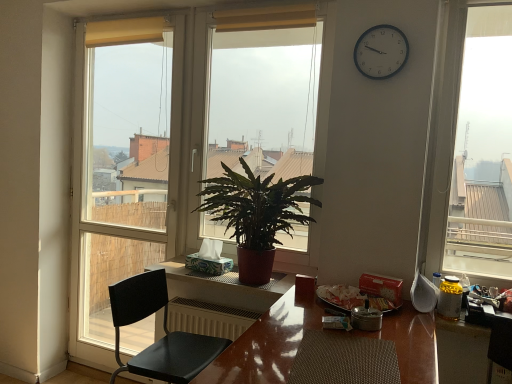
Question: Considering the relative sizes of glossy wooden table at center, acting as the 2th table starting from the back, and matte glass window at center, the second window in the left-to-right sequence, in the image provided, is glossy wooden table at center, acting as the 2th table starting from the back, thinner than matte glass window at center, the second window in the left-to-right sequence,?

Choices:
 (A) no
 (B) yes

Answer: (A)

Question: Considering the relative sizes of glossy wooden table at center, which is the 2th table in top-to-bottom order, and matte glass window at center, which appears as the first window when viewed from the right, in the image provided, is glossy wooden table at center, which is the 2th table in top-to-bottom order, smaller than matte glass window at center, which appears as the first window when viewed from the right,?

Choices:
 (A) yes
 (B) no

Answer: (B)

Question: Does glossy wooden table at center, acting as the 2th table starting from the back, have a larger size compared to matte glass window at center, the second window in the left-to-right sequence?

Choices:
 (A) yes
 (B) no

Answer: (A)

Question: Is matte glass window at center, which appears as the first window when viewed from the right, inside glossy wooden table at center, acting as the first table starting from the front?

Choices:
 (A) no
 (B) yes

Answer: (A)

Question: Is glossy wooden table at center, which is the 2th table in top-to-bottom order, further to the viewer compared to matte glass window at center, which appears as the first window when viewed from the right?

Choices:
 (A) no
 (B) yes

Answer: (A)

Question: Is glossy wooden table at center, which is the 2th table in top-to-bottom order, facing towards matte glass window at center, which appears as the first window when viewed from the right?

Choices:
 (A) no
 (B) yes

Answer: (A)

Question: Can you confirm if matte glass window at center, which appears as the first window when viewed from the right, is thinner than yellow fabric curtain at upper center, which appears as the first curtain when viewed from the right?

Choices:
 (A) no
 (B) yes

Answer: (A)

Question: Can we say matte glass window at center, which appears as the first window when viewed from the right, lies outside yellow fabric curtain at upper center, which appears as the first curtain when viewed from the right?

Choices:
 (A) yes
 (B) no

Answer: (A)

Question: Does matte glass window at center, the second window in the left-to-right sequence, turn towards yellow fabric curtain at upper center, placed as the second curtain when sorted from left to right?

Choices:
 (A) yes
 (B) no

Answer: (A)

Question: Can you confirm if matte glass window at center, the second window in the left-to-right sequence, is wider than yellow fabric curtain at upper center, which appears as the first curtain when viewed from the right?

Choices:
 (A) no
 (B) yes

Answer: (B)

Question: From the image's perspective, would you say matte glass window at center, the second window in the left-to-right sequence, is positioned over yellow fabric curtain at upper center, placed as the second curtain when sorted from left to right?

Choices:
 (A) yes
 (B) no

Answer: (B)

Question: Considering the relative sizes of matte glass window at center, the second window in the left-to-right sequence, and yellow fabric curtain at upper center, placed as the second curtain when sorted from left to right, in the image provided, is matte glass window at center, the second window in the left-to-right sequence, taller than yellow fabric curtain at upper center, placed as the second curtain when sorted from left to right,?

Choices:
 (A) yes
 (B) no

Answer: (A)

Question: Is glossy wooden table at center, acting as the 2th table starting from the back, oriented towards yellow fabric curtain at upper center, acting as the 1th curtain starting from the left?

Choices:
 (A) no
 (B) yes

Answer: (A)